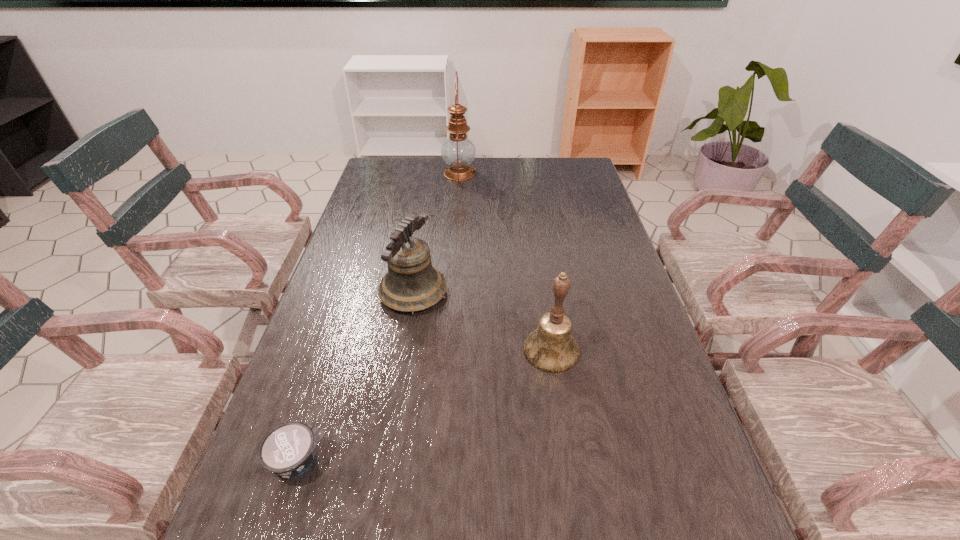
What are the coordinates of `vacant area between the leftmost object and the second farthest object` in the screenshot? It's located at (356, 377).

This screenshot has width=960, height=540. I want to click on free area in between the yogurt and the rightmost object, so click(x=424, y=406).

Locate an element on the screen. vacant area between the rightmost object and the nearest object is located at coordinates (424, 406).

Where is `unoccupied area between the right bell and the oil lamp`? The image size is (960, 540). unoccupied area between the right bell and the oil lamp is located at coordinates (505, 262).

Where is `unoccupied position between the rightmost object and the oil lamp`? Image resolution: width=960 pixels, height=540 pixels. unoccupied position between the rightmost object and the oil lamp is located at coordinates (505, 262).

Where is `vacant space that's between the farthest object and the yogurt`? vacant space that's between the farthest object and the yogurt is located at coordinates (379, 317).

Where is `vacant area between the right bell and the yogurt`? The height and width of the screenshot is (540, 960). vacant area between the right bell and the yogurt is located at coordinates (424, 406).

Identify the location of vacant space that's between the farthest object and the rightmost object. (505, 262).

Image resolution: width=960 pixels, height=540 pixels. I want to click on free space between the second farthest object and the oil lamp, so click(x=437, y=233).

The width and height of the screenshot is (960, 540). Identify the location of object that is the third closest one to the rightmost object. (458, 151).